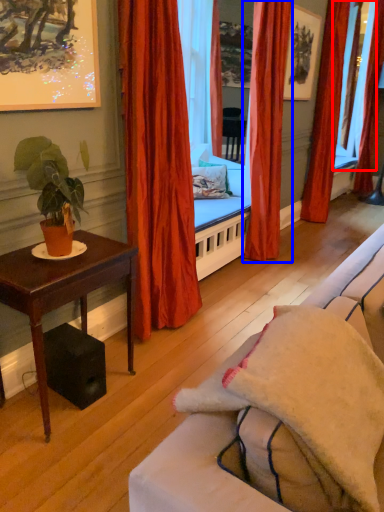
Question: Among these objects, which one is nearest to the camera, window screen (highlighted by a red box) or curtain (highlighted by a blue box)?

Choices:
 (A) window screen
 (B) curtain

Answer: (B)